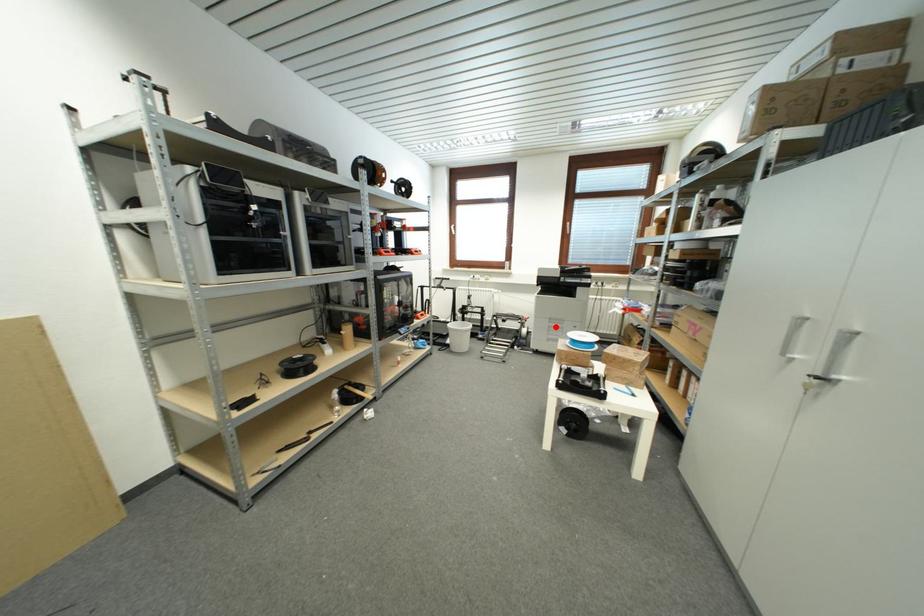
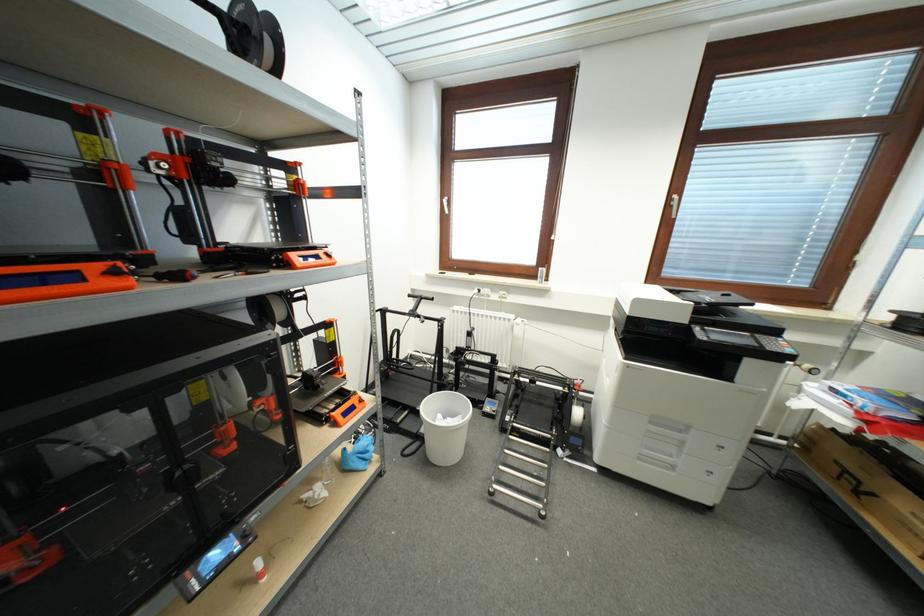
Question: I am providing you with two images of the same scene from different viewpoints. A red point is shown in image1. For the corresponding object point in image2, is it positioned nearer or farther from the camera?

Choices:
 (A) Nearer
 (B) Farther

Answer: (B)